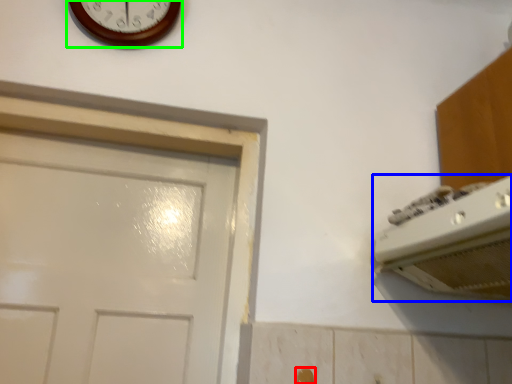
Question: Estimate the real-world distances between objects in this image. Which object is farther from door handle (highlighted by a red box), appliance (highlighted by a blue box) or wall clock (highlighted by a green box)?

Choices:
 (A) appliance
 (B) wall clock

Answer: (B)